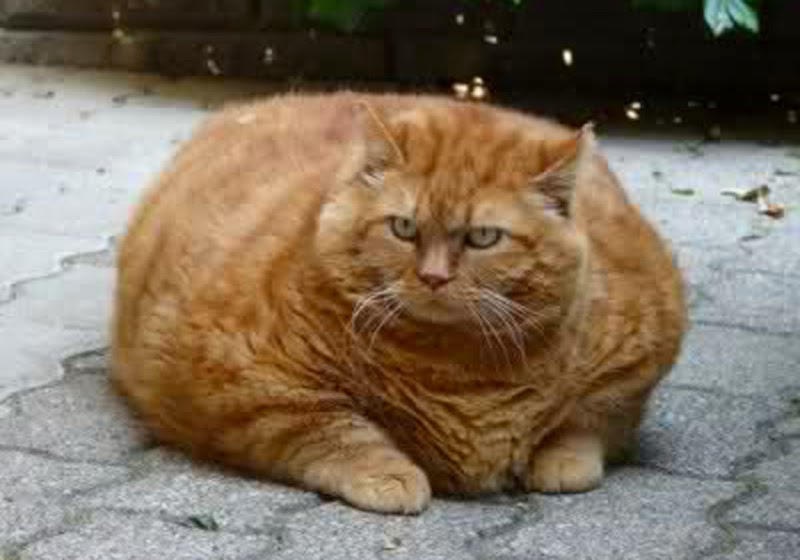
Locate an element on the screen. stone tiles is located at coordinates (638, 514), (390, 536), (221, 501), (145, 532).